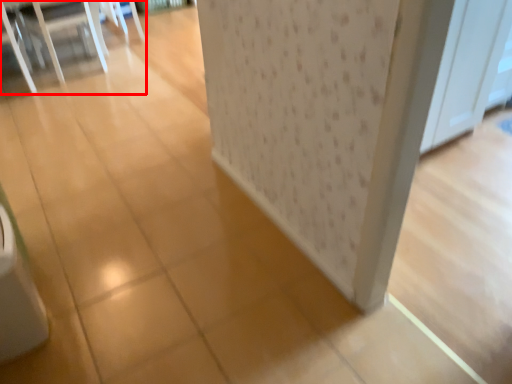
Question: From the image's perspective, where is furniture (annotated by the red box) located in relation to screen door in the image?

Choices:
 (A) below
 (B) above

Answer: (B)